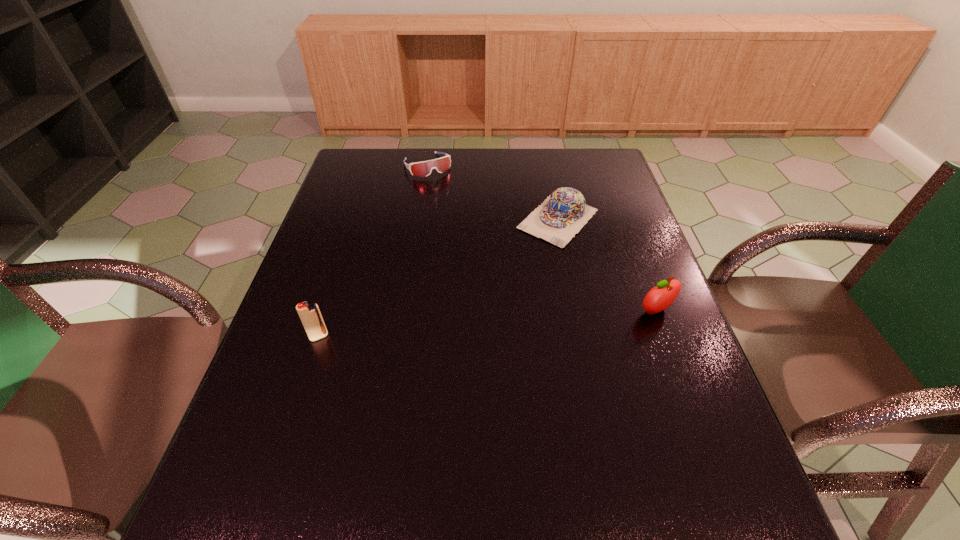
This screenshot has width=960, height=540. In the image, there is a desktop. Find the location of `free region at the far edge`. free region at the far edge is located at coordinates (457, 164).

Locate an element on the screen. This screenshot has height=540, width=960. free space at the left edge of the desktop is located at coordinates (337, 205).

The image size is (960, 540). I want to click on free point at the right edge, so click(612, 216).

Where is `vacant space at the far left corner of the desktop`? vacant space at the far left corner of the desktop is located at coordinates (384, 148).

Find the location of `free space at the far right corner of the desktop`. free space at the far right corner of the desktop is located at coordinates (603, 172).

Image resolution: width=960 pixels, height=540 pixels. Find the location of `free point between the goggles and the leftmost object`. free point between the goggles and the leftmost object is located at coordinates (373, 251).

The height and width of the screenshot is (540, 960). Identify the location of vacant region between the third object from right to left and the nearest object. (373, 251).

Where is `empty location between the apple and the cap`? Image resolution: width=960 pixels, height=540 pixels. empty location between the apple and the cap is located at coordinates (607, 265).

Find the location of a particular element. Image resolution: width=960 pixels, height=540 pixels. free space between the farthest object and the third nearest object is located at coordinates (492, 192).

Locate an element on the screen. free space between the goggles and the second farthest object is located at coordinates (492, 192).